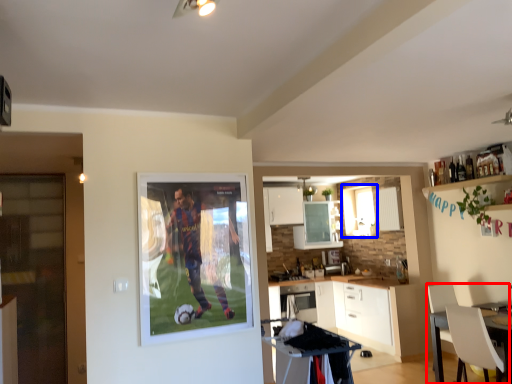
Question: Which object appears closest to the camera in this image, chair (highlighted by a red box) or window (highlighted by a blue box)?

Choices:
 (A) chair
 (B) window

Answer: (A)